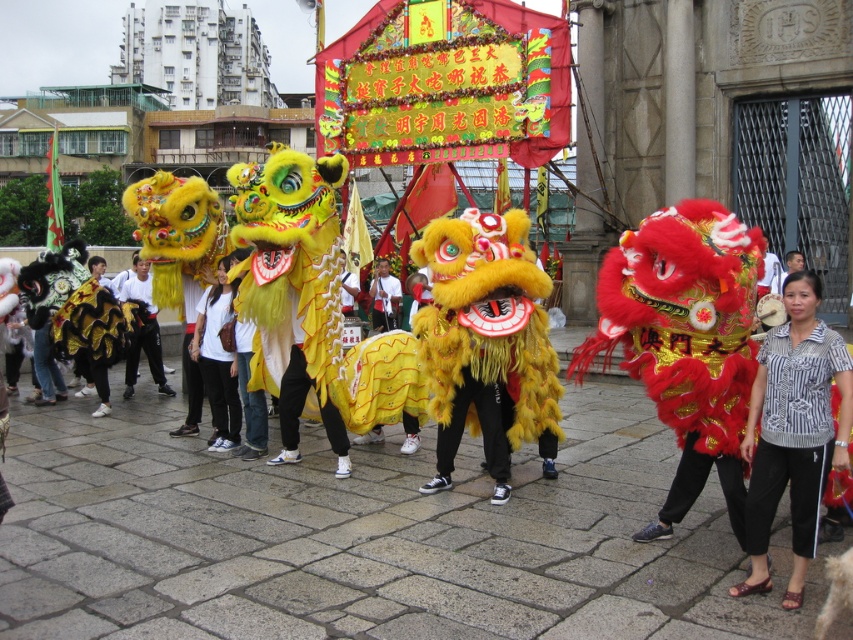
Can you confirm if striped shirt at center is taller than white cotton shirt at center?

In fact, striped shirt at center may be shorter than white cotton shirt at center.

Which is more to the left, striped shirt at center or white cotton shirt at center?

From the viewer's perspective, white cotton shirt at center appears more on the left side.

Locate an element on the screen. The width and height of the screenshot is (853, 640). striped shirt at center is located at coordinates (793, 432).

Who is taller, yellow fuzzy lion at center or striped shirt at center?

yellow fuzzy lion at center is taller.

Which is behind, point (184, 496) or point (741, 451)?

Positioned behind is point (184, 496).

Where is `yellow fuzzy lion at center`? The width and height of the screenshot is (853, 640). yellow fuzzy lion at center is located at coordinates (352, 531).

Consider the image. Does yellow fuzzy lion at center appear on the right side of white cotton shirt at center?

Indeed, yellow fuzzy lion at center is positioned on the right side of white cotton shirt at center.

Measure the distance between yellow fuzzy lion at center and camera.

yellow fuzzy lion at center is 17.63 meters from camera.

Is point (143, 515) farther from camera compared to point (396, 298)?

No, (143, 515) is in front of (396, 298).

The width and height of the screenshot is (853, 640). I want to click on yellow fuzzy lion at center, so click(x=352, y=531).